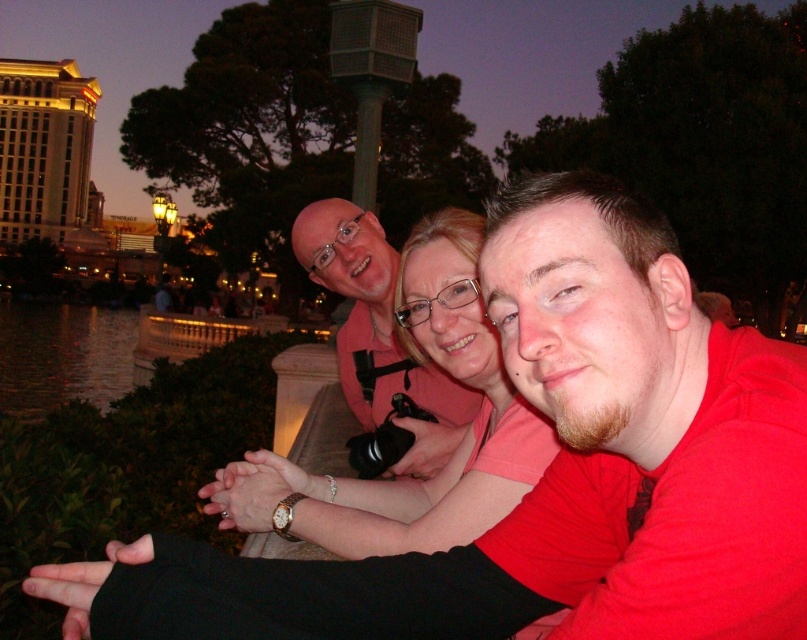
You are a photographer trying to capture the scene with the matte pink shirt at center and the dark reflective water at lower left. Since you want to ensure the pink shirt is clearly visible against the dark water, which object should be placed in front to create contrast?

The matte pink shirt at center is thinner than the dark reflective water at lower left, so placing the matte pink shirt at center in front would create better contrast against the dark reflective water at lower left.

You are standing at the origin point of the image coordinate system, which is the bottom left corner. You want to move towards the two points labeled as point (287, 524) and point (425, 465). Which point should you approach first if you need to reach the one that is closer to you first?

Point (287, 524) is in front of point (425, 465), so you should approach point (287, 524) first as it is closer to your current position at the origin.

You are a photographer trying to capture the three people in the scene. The camera you are using has a limited field of view. Given the positions of the matte pink shirt at center and dark reflective water at lower left, which object is positioned higher in the frame?

The matte pink shirt at center is much taller than the dark reflective water at lower left, so it is positioned higher in the frame.